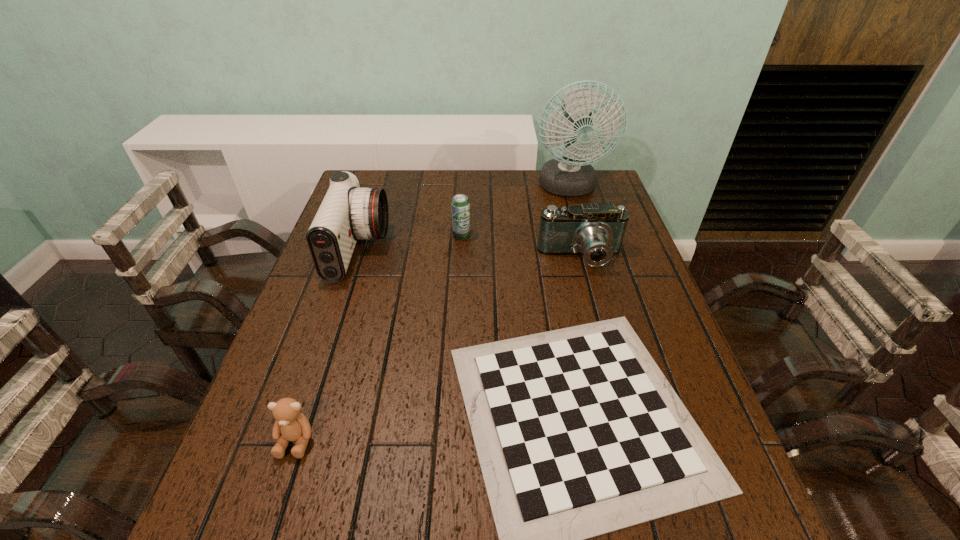
Where is `vacant region at the left edge of the desktop`? The width and height of the screenshot is (960, 540). vacant region at the left edge of the desktop is located at coordinates (264, 443).

This screenshot has width=960, height=540. In order to click on free spot at the right edge of the desktop in this screenshot , I will do `click(670, 329)`.

Where is `free region at the far left corner`? free region at the far left corner is located at coordinates (389, 179).

Where is `vacant area between the beer can and the second shortest object`? Image resolution: width=960 pixels, height=540 pixels. vacant area between the beer can and the second shortest object is located at coordinates (379, 338).

The width and height of the screenshot is (960, 540). Identify the location of free area in between the fifth tallest object and the left camcorder. (327, 345).

The width and height of the screenshot is (960, 540). I want to click on free space between the second shortest object and the fan, so click(x=432, y=314).

Image resolution: width=960 pixels, height=540 pixels. Identify the location of object that is the fourth nearest to the left camcorder. (596, 231).

Locate an element on the screen. the second closest object to the chessboard is located at coordinates (348, 212).

I want to click on free space that satisfies the following two spatial constraints: 1. on the surface of the left camcorder; 2. on the face of the teddy bear, so click(x=297, y=440).

At what (x,y) coordinates should I click in order to perform the action: click on free location that satisfies the following two spatial constraints: 1. in front of the farthest object where the airflow is directed; 2. on the surface of the fifth shortest object. Please return your answer as a coordinate pair (x, y). Looking at the image, I should click on (586, 250).